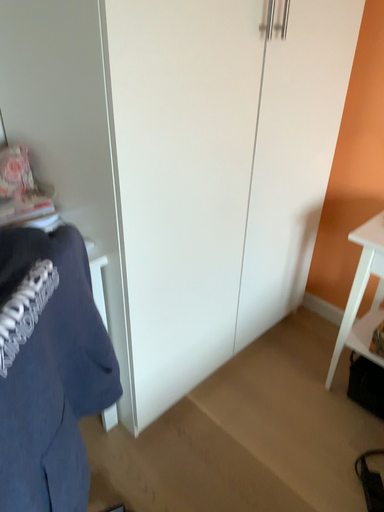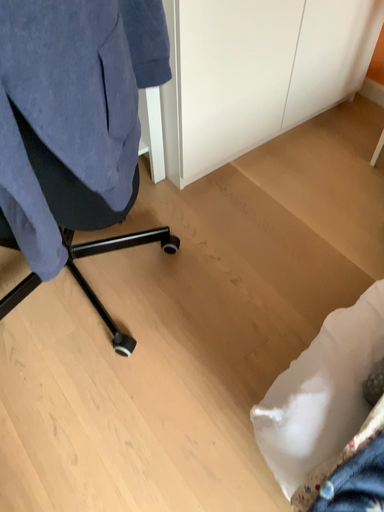
Question: Which way did the camera rotate in the video?

Choices:
 (A) rotated downward
 (B) rotated upward

Answer: (A)